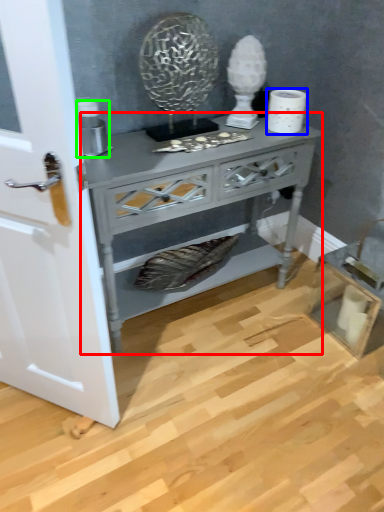
Question: Considering the real-world distances, which object is farthest from nightstand (highlighted by a red box)? toilet paper (highlighted by a blue box) or appliance (highlighted by a green box)?

Choices:
 (A) toilet paper
 (B) appliance

Answer: (A)